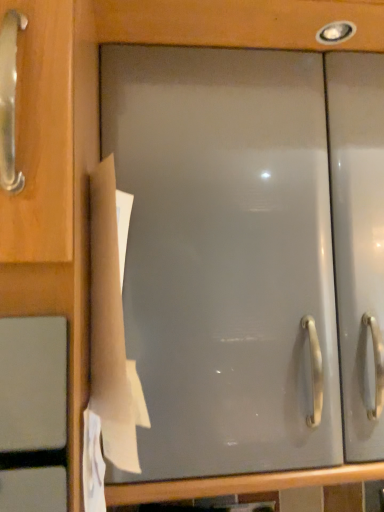
What do you see at coordinates (112, 324) in the screenshot? The width and height of the screenshot is (384, 512). I see `white paper at left` at bounding box center [112, 324].

This screenshot has height=512, width=384. I want to click on white paper at left, so click(x=112, y=324).

At what (x,y) coordinates should I click in order to perform the action: click on white paper at left. Please return your answer as a coordinate pair (x, y). The height and width of the screenshot is (512, 384). Looking at the image, I should click on (112, 324).